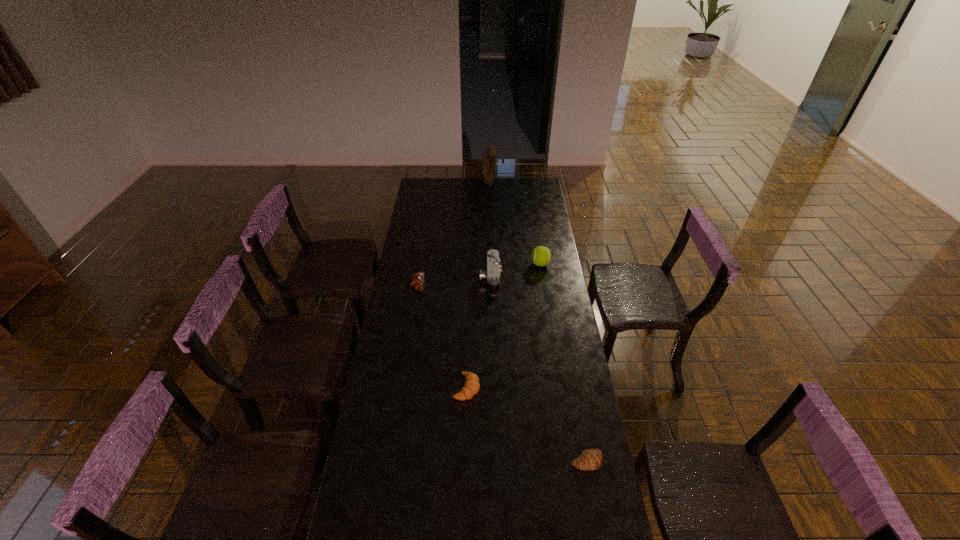
I want to click on free region that satisfies the following two spatial constraints: 1. on the front-facing side of the figurine; 2. on the lens of the camera, so click(492, 279).

At what (x,y) coordinates should I click in order to perform the action: click on vacant space that satisfies the following two spatial constraints: 1. on the front-facing side of the nearest crescent roll; 2. on the left side of the farthest object. Please return your answer as a coordinate pair (x, y). Looking at the image, I should click on (497, 461).

The image size is (960, 540). What are the coordinates of `free space that satisfies the following two spatial constraints: 1. on the back side of the tennis ball; 2. on the right side of the second nearest object` in the screenshot? It's located at (470, 264).

I want to click on vacant region that satisfies the following two spatial constraints: 1. on the front-facing side of the farthest object; 2. on the right side of the tennis ball, so click(492, 264).

Find the location of `vacant space that satisfies the following two spatial constraints: 1. on the front-facing side of the farthest object; 2. on the lens of the camera`. vacant space that satisfies the following two spatial constraints: 1. on the front-facing side of the farthest object; 2. on the lens of the camera is located at coordinates (492, 279).

Image resolution: width=960 pixels, height=540 pixels. Find the location of `free space in the image that satisfies the following two spatial constraints: 1. on the front-facing side of the tennis ball; 2. on the right side of the tallest object`. free space in the image that satisfies the following two spatial constraints: 1. on the front-facing side of the tennis ball; 2. on the right side of the tallest object is located at coordinates (492, 264).

You are a GUI agent. You are given a task and a screenshot of the screen. Output one action in this format:
    pyautogui.click(x=<x>, y=<y>)
    Task: Click on the free space that satisfies the following two spatial constraints: 1. on the front side of the tennis ball; 2. on the lens of the camera
    Image resolution: width=960 pixels, height=540 pixels.
    Given the screenshot: What is the action you would take?
    pyautogui.click(x=542, y=279)

Image resolution: width=960 pixels, height=540 pixels. I want to click on vacant position in the image that satisfies the following two spatial constraints: 1. on the lens of the nearest object; 2. on the right side of the camera, so click(x=495, y=461).

Identify the location of free space in the image that satisfies the following two spatial constraints: 1. on the back side of the tennis ball; 2. on the left side of the leftmost object. The height and width of the screenshot is (540, 960). (420, 264).

In order to click on free location that satisfies the following two spatial constraints: 1. on the front-facing side of the nearest crescent roll; 2. on the right side of the figurine in this screenshot , I will do `click(497, 461)`.